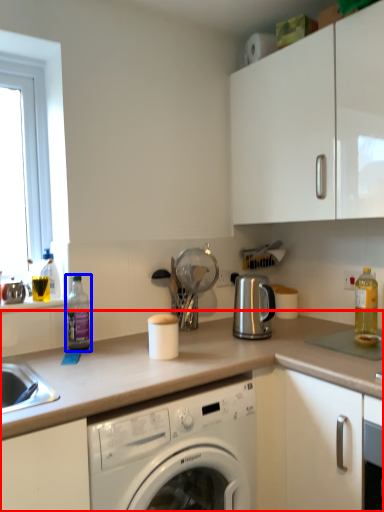
Question: Which object appears closest to the camera in this image, countertop (highlighted by a red box) or bottle (highlighted by a blue box)?

Choices:
 (A) countertop
 (B) bottle

Answer: (A)